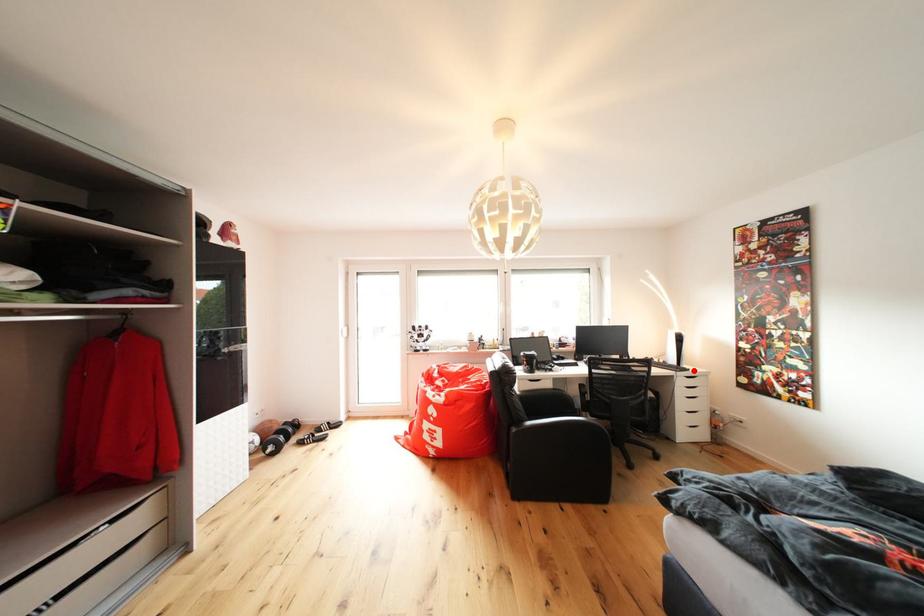
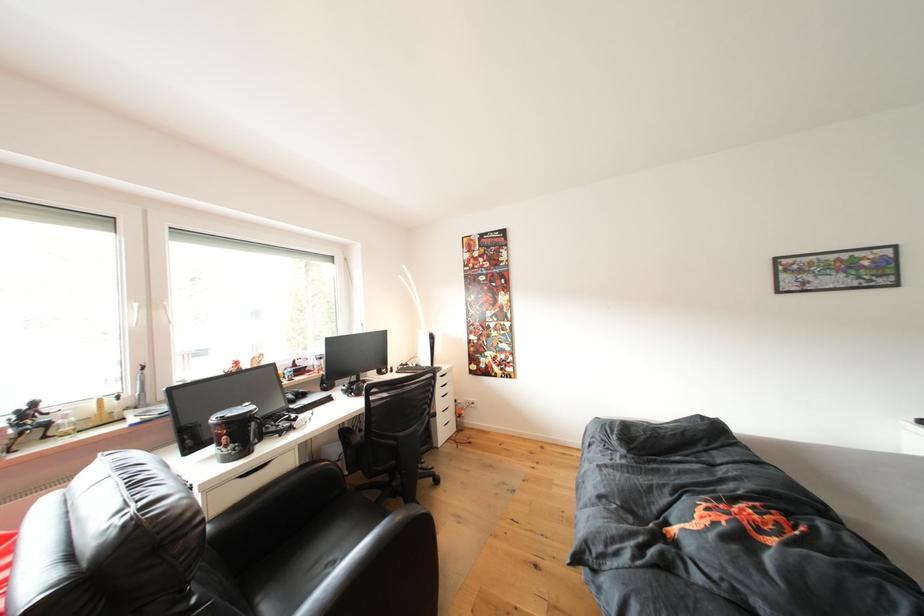
Locate, in the second image, the point that corresponds to the highlighted location in the first image.

(444, 370)